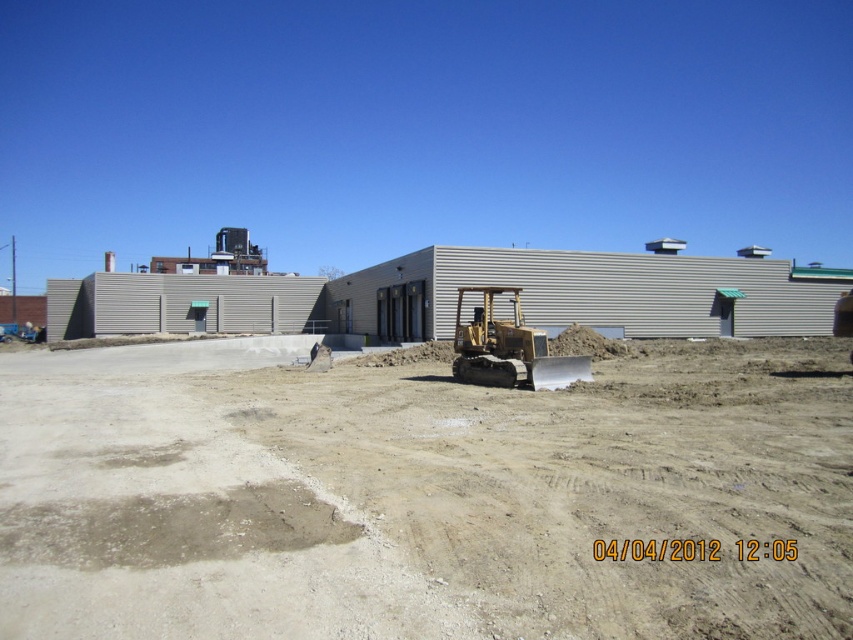
Question: Which point is closer to the camera?

Choices:
 (A) (233, 401)
 (B) (465, 340)

Answer: (A)

Question: Is brown sandy dirt at center wider than gold metallic excavator at center?

Choices:
 (A) yes
 (B) no

Answer: (A)

Question: Among these points, which one is nearest to the camera?

Choices:
 (A) (511, 291)
 (B) (372, 400)

Answer: (B)

Question: Is brown sandy dirt at center wider than gold metallic excavator at center?

Choices:
 (A) no
 (B) yes

Answer: (B)

Question: Does brown sandy dirt at center have a greater width compared to gold metallic excavator at center?

Choices:
 (A) yes
 (B) no

Answer: (A)